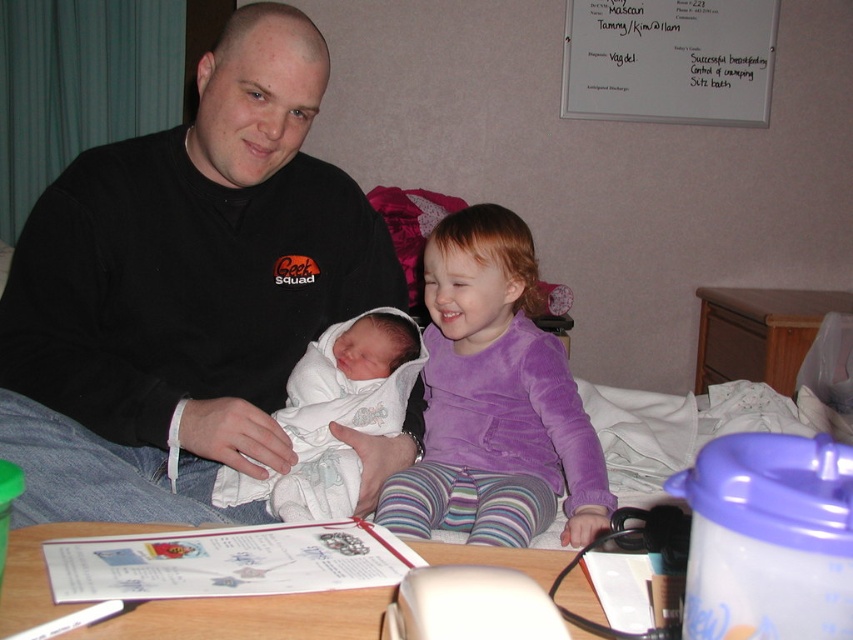
You are a nurse in the hospital room and need to retrieve an item from either point A or point B. Point A is located at point [236,618] and point B is at point [305,483]. Which point is closer to you?

Point A at [236,618] is closer to you than point B at [305,483].

You are a nurse in the hospital room and need to place a medical kit on the purple velvety shirt at center and the white plastic table at lower center. Which surface can you place the medical kit on without it falling off?

The white plastic table at lower center is a stable surface for placing the medical kit, while the purple velvety shirt at center is above it and likely not a flat surface. The medical kit should be placed on the white plastic table at lower center to prevent it from falling.